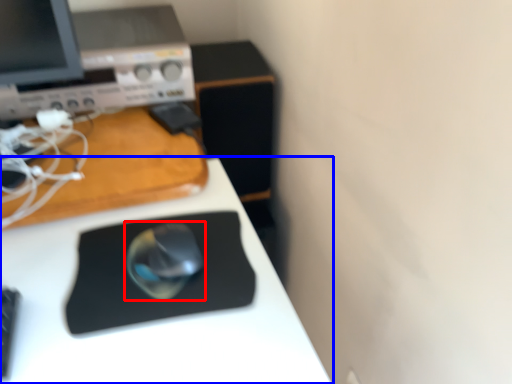
Question: Which object appears farthest to the camera in this image, mouse (highlighted by a red box) or desk (highlighted by a blue box)?

Choices:
 (A) mouse
 (B) desk

Answer: (A)